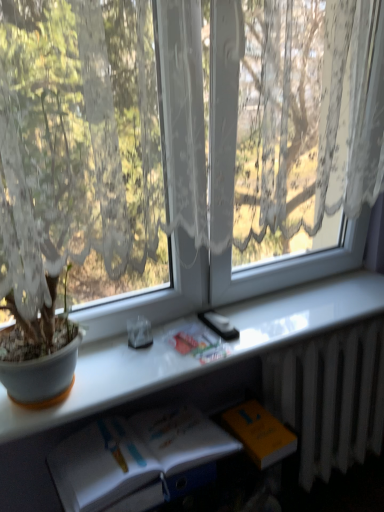
I want to click on vacant space in front of matte plastic book at center, marked as the 2th book in a bottom-to-top arrangement, so click(x=168, y=367).